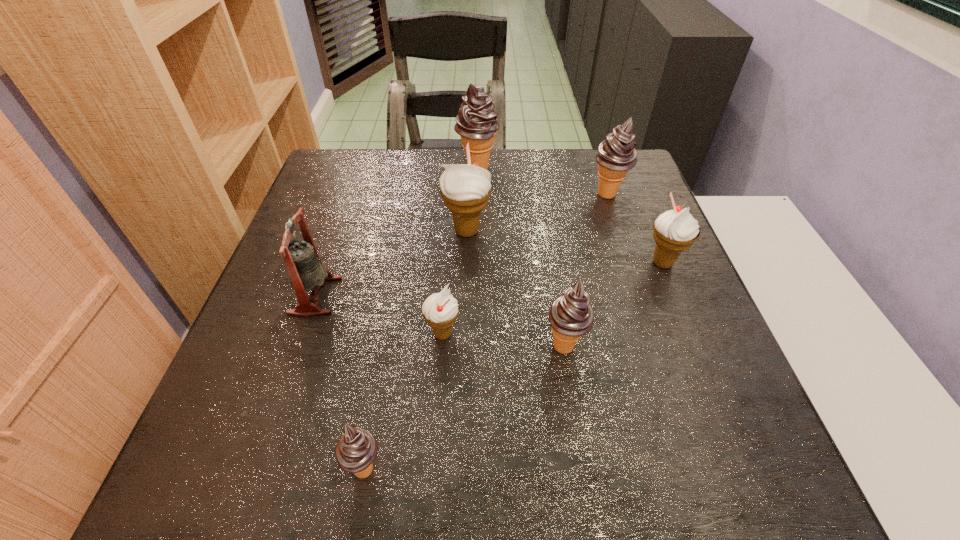
What are the coordinates of `the fourth farthest icecream` in the screenshot? It's located at (676, 230).

At what (x,y) coordinates should I click in order to perform the action: click on the nearest white icecream. Please return your answer as a coordinate pair (x, y). This screenshot has width=960, height=540. Looking at the image, I should click on (440, 310).

The image size is (960, 540). I want to click on the leftmost icecream, so click(356, 450).

Where is `the nearest chocolate icecream`? The image size is (960, 540). the nearest chocolate icecream is located at coordinates (356, 450).

Where is `free space located on the front of the second chocolate icecream from left to right`? free space located on the front of the second chocolate icecream from left to right is located at coordinates (477, 200).

Locate an element on the screen. vacant area located 0.110m on the front of the third smallest chocolate icecream is located at coordinates (621, 233).

In order to click on free space located on the left of the farthest white icecream in this screenshot , I will do `click(385, 231)`.

Image resolution: width=960 pixels, height=540 pixels. I want to click on blank space located on the back of the bell, so click(341, 224).

Identify the location of vacant space located on the left of the sixth object from left to right. (506, 346).

Locate an element on the screen. This screenshot has width=960, height=540. vacant space located 0.340m on the front of the second nearest white icecream is located at coordinates (731, 428).